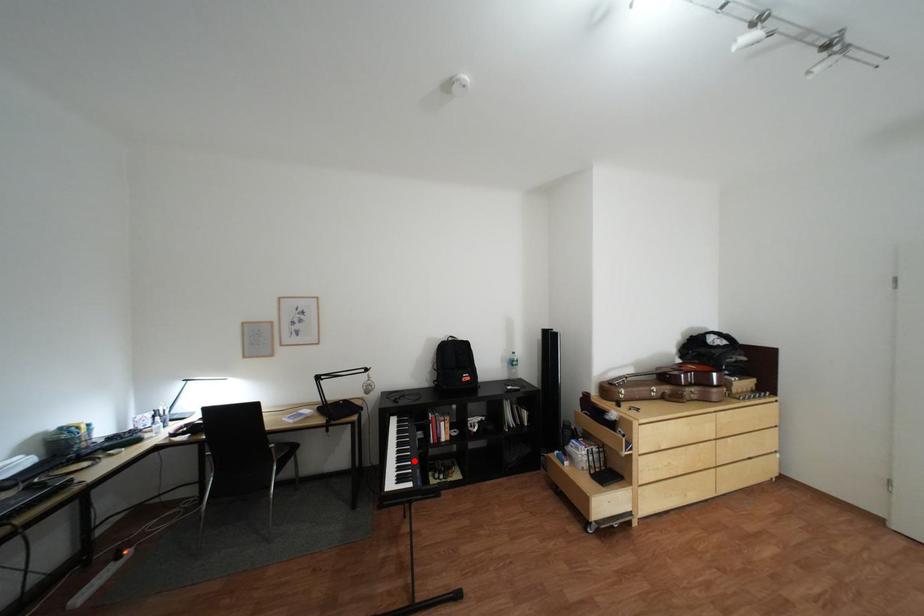
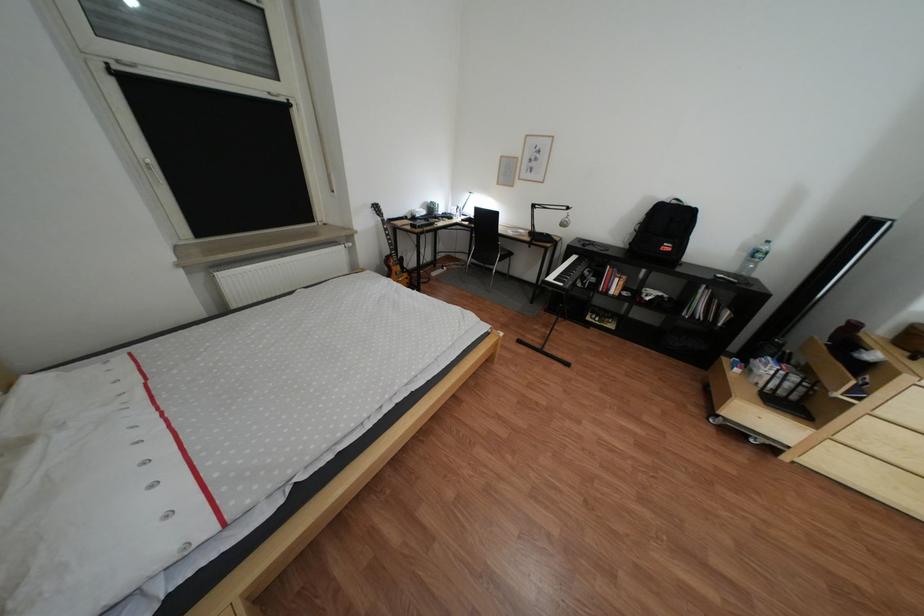
The point at the highlighted location is marked in the first image. Where is the corresponding point in the second image?

(578, 274)